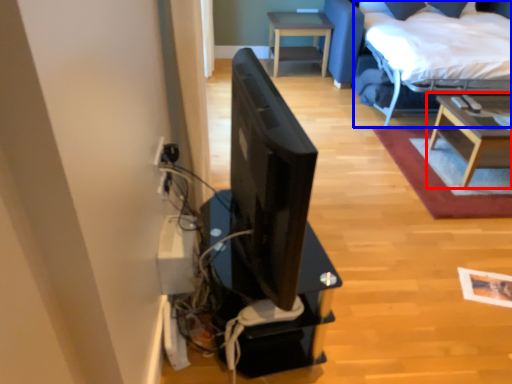
Question: Which object is further to the camera taking this photo, table (highlighted by a red box) or bed (highlighted by a blue box)?

Choices:
 (A) table
 (B) bed

Answer: (B)